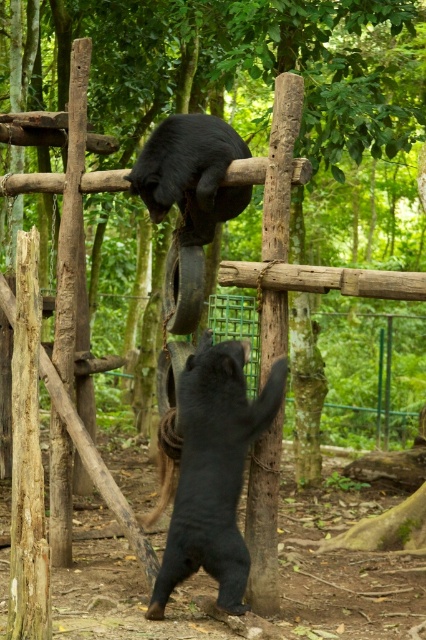
Does shiny black bear at center come in front of brown wood pole at center?

Yes.

Is shiny black bear at center to the right of brown wood pole at center from the viewer's perspective?

Incorrect, shiny black bear at center is not on the right side of brown wood pole at center.

What do you see at coordinates (213, 470) in the screenshot? I see `shiny black bear at center` at bounding box center [213, 470].

This screenshot has width=426, height=640. What are the coordinates of `shiny black bear at center` in the screenshot? It's located at (213, 470).

Between shiny black bear at center and black matte bear at upper center, which one has more height?

Standing taller between the two is shiny black bear at center.

Is point (204, 416) closer to camera compared to point (164, 211)?

Yes, it is in front of point (164, 211).

You are a GUI agent. You are given a task and a screenshot of the screen. Output one action in this format:
    pyautogui.click(x=<x>, y=<y>)
    Task: Click on the shiny black bear at center
    The image size is (426, 640).
    Given the screenshot: What is the action you would take?
    pyautogui.click(x=213, y=470)

Between brown wood pole at center and black matte bear at upper center, which one appears on the right side from the viewer's perspective?

brown wood pole at center

Who is more distant from viewer, (301,115) or (247,204)?

The point (247,204) is behind.

The width and height of the screenshot is (426, 640). What are the coordinates of `brown wood pole at center` in the screenshot? It's located at [278, 216].